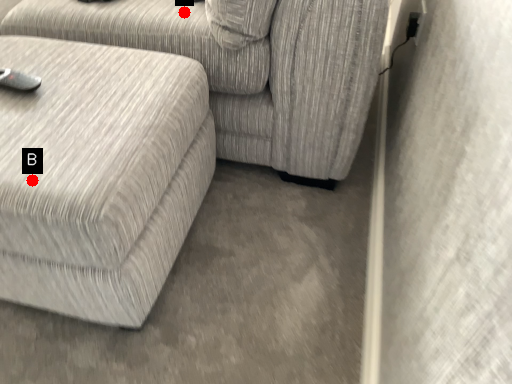
Question: Two points are circled on the image, labeled by A and B beside each circle. Which point is closer to the camera?

Choices:
 (A) A is closer
 (B) B is closer

Answer: (B)